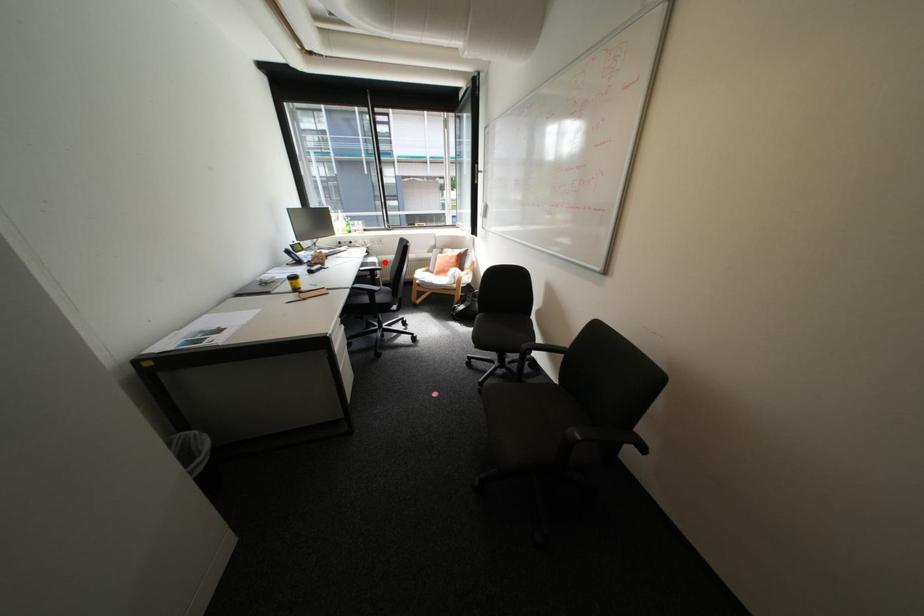
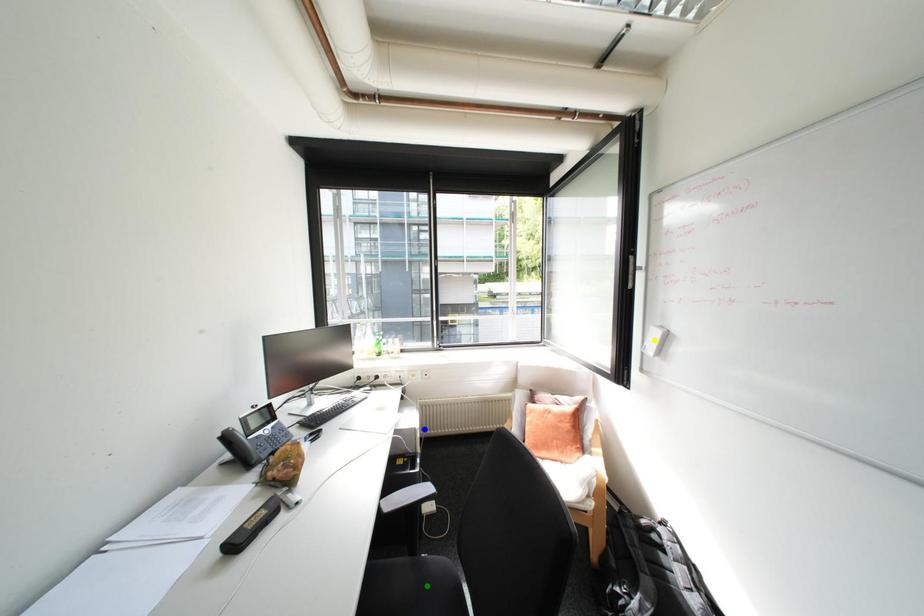
Question: I am providing you with two images of the same scene from different viewpoints. A red point is marked on the first image. You are given multiple points on the second image. Which spot in image 2 lines up with the point in image 1?

Choices:
 (A) green point
 (B) blue point
 (C) yellow point

Answer: (B)